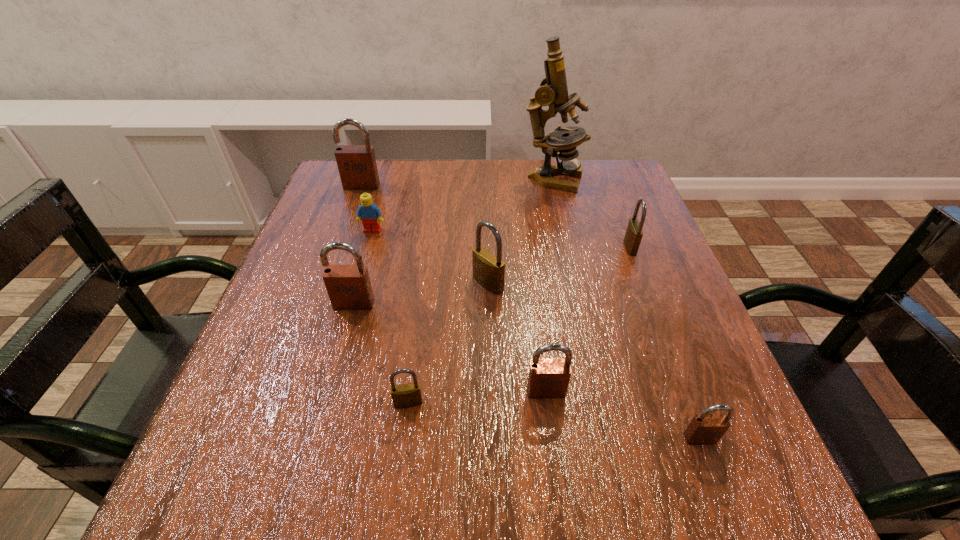
This screenshot has width=960, height=540. Identify the location of microscope. (553, 92).

In order to click on the biggest brown padlock in this screenshot , I will do `click(357, 167)`.

Where is `the tallest padlock`? This screenshot has height=540, width=960. the tallest padlock is located at coordinates 357,167.

Image resolution: width=960 pixels, height=540 pixels. What are the coordinates of `the fourth padlock from right to left` in the screenshot? It's located at (488, 270).

The image size is (960, 540). What are the coordinates of `the biggest brass padlock` in the screenshot? It's located at (488, 270).

At what (x,y) coordinates should I click in order to perform the action: click on the third smallest brown padlock. Please return your answer as a coordinate pair (x, y). This screenshot has width=960, height=540. Looking at the image, I should click on (348, 286).

Locate an element on the screen. The width and height of the screenshot is (960, 540). the sixth farthest object is located at coordinates (348, 286).

The width and height of the screenshot is (960, 540). I want to click on the rightmost brass padlock, so click(x=633, y=236).

This screenshot has width=960, height=540. Find the location of `the fourth farthest object`. the fourth farthest object is located at coordinates (633, 236).

Locate an element on the screen. The image size is (960, 540). the second nearest brown padlock is located at coordinates (548, 378).